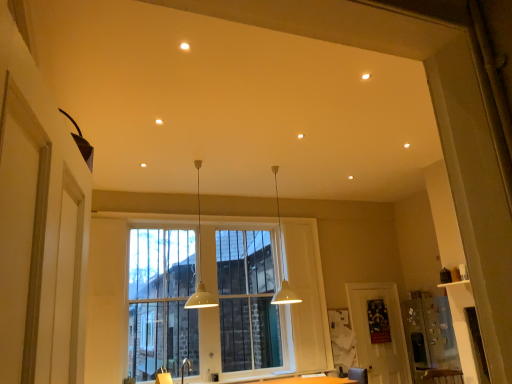
Question: Is the depth of white matte pendant light at center, positioned as the first lamp in right-to-left order, less than that of clear glass window at center?

Choices:
 (A) no
 (B) yes

Answer: (B)

Question: Considering the relative sizes of white matte pendant light at center, positioned as the first lamp in right-to-left order, and clear glass window at center in the image provided, is white matte pendant light at center, positioned as the first lamp in right-to-left order, thinner than clear glass window at center?

Choices:
 (A) yes
 (B) no

Answer: (B)

Question: Is white matte pendant light at center, positioned as the first lamp in right-to-left order, outside of clear glass window at center?

Choices:
 (A) yes
 (B) no

Answer: (A)

Question: Does white matte pendant light at center, positioned as the first lamp in right-to-left order, appear on the right side of clear glass window at center?

Choices:
 (A) no
 (B) yes

Answer: (B)

Question: Does white matte pendant light at center, positioned as the first lamp in right-to-left order, turn towards clear glass window at center?

Choices:
 (A) no
 (B) yes

Answer: (A)

Question: Is white matte pendant light at center, positioned as the first lamp in right-to-left order, wider or thinner than matte white screen door at lower right?

Choices:
 (A) wide
 (B) thin

Answer: (A)

Question: Is point (280, 261) closer or farther from the camera than point (372, 319)?

Choices:
 (A) closer
 (B) farther

Answer: (A)

Question: Considering their positions, is white matte pendant light at center, the 2th lamp when ordered from left to right, located in front of or behind matte white screen door at lower right?

Choices:
 (A) behind
 (B) front

Answer: (B)

Question: In terms of height, does white matte pendant light at center, the 2th lamp when ordered from left to right, look taller or shorter compared to matte white screen door at lower right?

Choices:
 (A) short
 (B) tall

Answer: (B)

Question: Looking at their shapes, would you say clear glass window at center is wider or thinner than white matte pendant light at center, the 2th lamp in the right-to-left sequence?

Choices:
 (A) thin
 (B) wide

Answer: (A)

Question: From a real-world perspective, is clear glass window at center physically located above or below white matte pendant light at center, the first lamp positioned from the left?

Choices:
 (A) above
 (B) below

Answer: (B)

Question: Is clear glass window at center bigger or smaller than white matte pendant light at center, the 2th lamp in the right-to-left sequence?

Choices:
 (A) big
 (B) small

Answer: (A)

Question: Is point (139, 370) positioned closer to the camera than point (198, 307)?

Choices:
 (A) closer
 (B) farther

Answer: (B)

Question: From the image's perspective, is matte white screen door at lower right positioned above or below white matte pendant light at center, the 2th lamp in the right-to-left sequence?

Choices:
 (A) above
 (B) below

Answer: (B)

Question: Looking at the image, does matte white screen door at lower right seem bigger or smaller compared to white matte pendant light at center, the first lamp positioned from the left?

Choices:
 (A) small
 (B) big

Answer: (A)